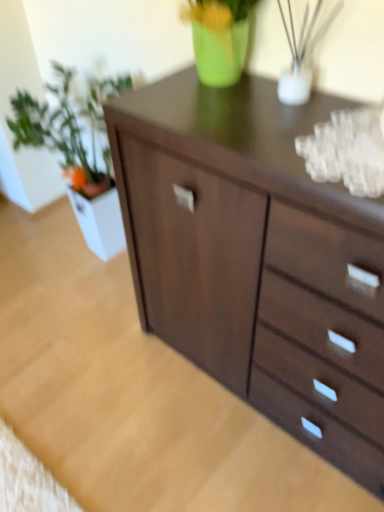
I want to click on free region on the left part of green matte plant at left, so click(x=21, y=250).